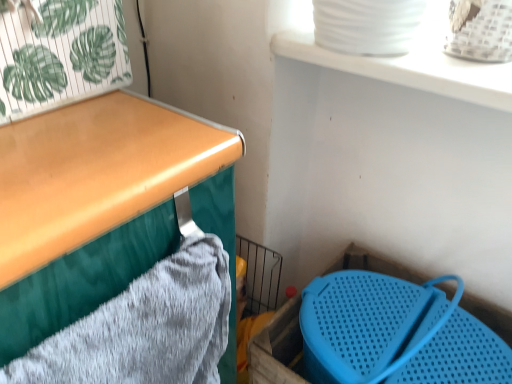
Question: Is gray textured bath towel at left located within green leafy paper at upper left?

Choices:
 (A) yes
 (B) no

Answer: (B)

Question: Is green leafy paper at upper left shorter than gray textured bath towel at left?

Choices:
 (A) no
 (B) yes

Answer: (B)

Question: Does green leafy paper at upper left have a greater height compared to gray textured bath towel at left?

Choices:
 (A) no
 (B) yes

Answer: (A)

Question: From a real-world perspective, does green leafy paper at upper left sit lower than gray textured bath towel at left?

Choices:
 (A) yes
 (B) no

Answer: (B)

Question: Considering the relative sizes of green leafy paper at upper left and gray textured bath towel at left in the image provided, is green leafy paper at upper left bigger than gray textured bath towel at left?

Choices:
 (A) yes
 (B) no

Answer: (A)

Question: Is green leafy paper at upper left smaller than gray textured bath towel at left?

Choices:
 (A) yes
 (B) no

Answer: (B)

Question: Considering the relative sizes of blue plastic storage box at lower right and gray textured bath towel at left in the image provided, is blue plastic storage box at lower right smaller than gray textured bath towel at left?

Choices:
 (A) no
 (B) yes

Answer: (A)

Question: Is blue plastic storage box at lower right touching gray textured bath towel at left?

Choices:
 (A) yes
 (B) no

Answer: (B)

Question: From the image's perspective, is blue plastic storage box at lower right located above gray textured bath towel at left?

Choices:
 (A) yes
 (B) no

Answer: (B)

Question: From a real-world perspective, is blue plastic storage box at lower right located higher than gray textured bath towel at left?

Choices:
 (A) no
 (B) yes

Answer: (A)

Question: Is blue plastic storage box at lower right thinner than gray textured bath towel at left?

Choices:
 (A) no
 (B) yes

Answer: (A)

Question: Is blue plastic storage box at lower right to the left of gray textured bath towel at left from the viewer's perspective?

Choices:
 (A) yes
 (B) no

Answer: (B)

Question: Is blue plastic storage box at lower right not within green leafy paper at upper left?

Choices:
 (A) no
 (B) yes

Answer: (B)